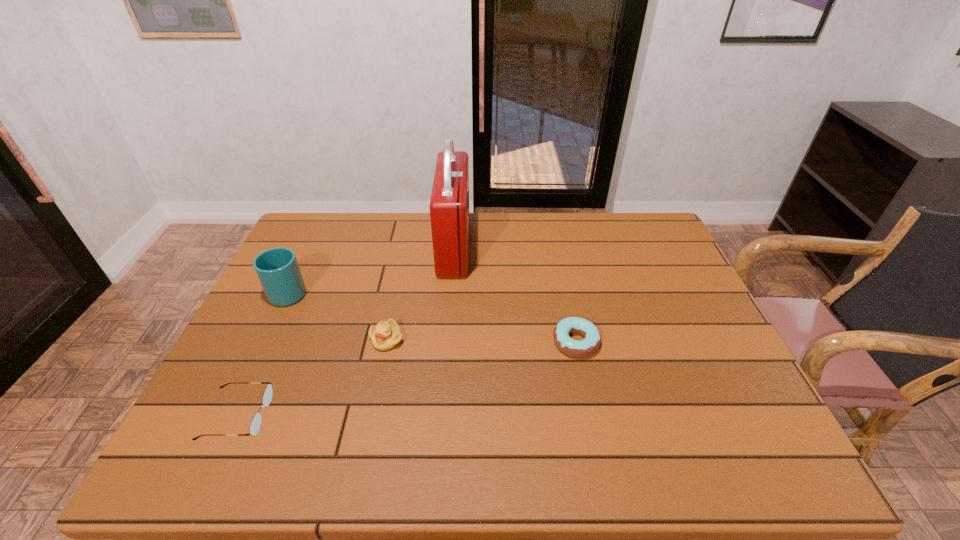
Find the location of a particular element. This screenshot has width=960, height=540. blank area located on the handle side of the cup is located at coordinates (304, 260).

I want to click on free space located at the face of the third object from right to left, so click(378, 382).

What are the coordinates of `free location located on the lenses of the spectacles` in the screenshot? It's located at (325, 415).

Identify the location of vacant area situated 0.380m on the back of the rightmost object. (554, 240).

Identify the location of object located in the far edge section of the desktop. (449, 205).

This screenshot has height=540, width=960. I want to click on object that is at the near edge, so (255, 424).

The height and width of the screenshot is (540, 960). Identify the location of cup located at the left edge. (278, 271).

Locate an element on the screen. This screenshot has height=540, width=960. spectacles present at the left edge is located at coordinates (255, 424).

Locate an element on the screen. This screenshot has width=960, height=540. object situated at the near left corner is located at coordinates click(255, 424).

Identify the location of vacant space at the far edge of the desktop. Image resolution: width=960 pixels, height=540 pixels. pyautogui.click(x=371, y=241).